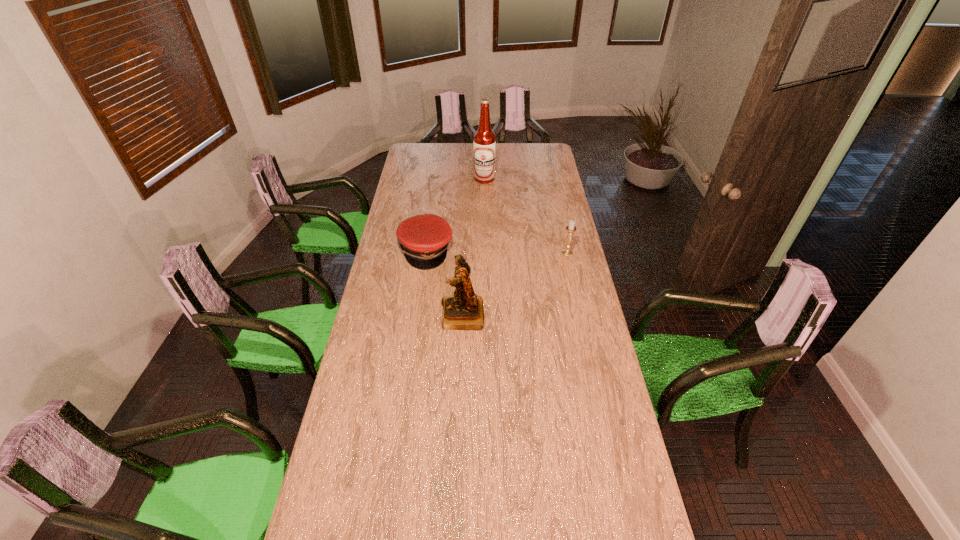
Image resolution: width=960 pixels, height=540 pixels. Find the location of `vacant space situated on the back of the rightmost object`. vacant space situated on the back of the rightmost object is located at coordinates coord(558,212).

Locate an element on the screen. free spot located 0.230m on the front-facing side of the cap is located at coordinates (491, 280).

Where is `free space located 0.290m on the front-facing side of the cap`? The width and height of the screenshot is (960, 540). free space located 0.290m on the front-facing side of the cap is located at coordinates (502, 285).

The image size is (960, 540). What are the coordinates of `free spot located on the front-facing side of the cap` in the screenshot? It's located at (518, 292).

Where is `vacant point located 0.170m on the label side of the farthest object`? vacant point located 0.170m on the label side of the farthest object is located at coordinates (494, 200).

What are the coordinates of `vacant region located on the label side of the farthest object` in the screenshot? It's located at (492, 194).

Find the location of a particular element. free spot located 0.130m on the label side of the farthest object is located at coordinates (492, 197).

Find the location of `object at the left edge`. object at the left edge is located at coordinates (424, 238).

This screenshot has width=960, height=540. In order to click on object at the right edge in this screenshot , I will do tap(571, 228).

The height and width of the screenshot is (540, 960). In the image, there is a desktop. In order to click on vacant space at the near edge in this screenshot , I will do 473,500.